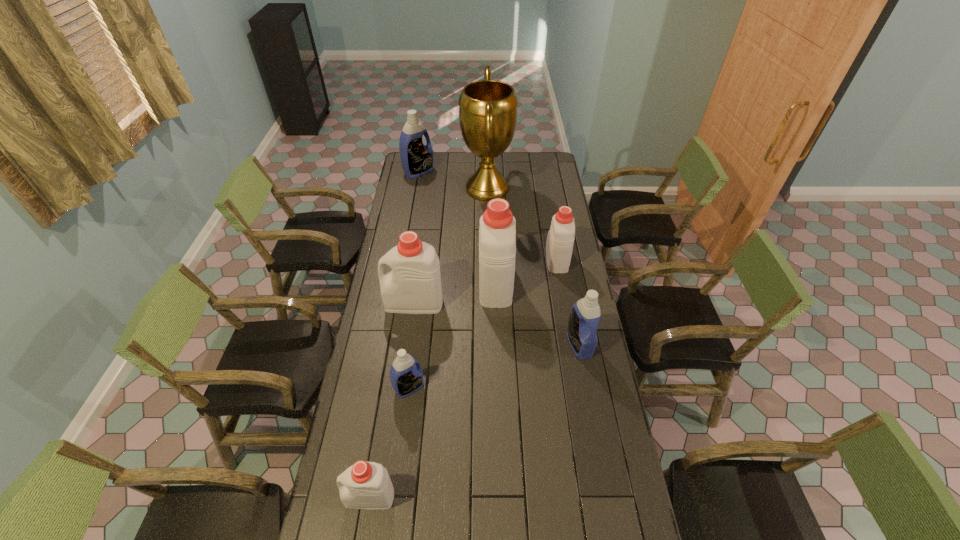
Locate which object ranks sixth in proximity to the second tallest object. Please provide its 2D coordinates. Your answer should be formatted as a tuple, i.e. [(x, y)], where the tuple contains the x and y coordinates of a point satisfying the conditions above.

[(417, 159)]

Select which object is the third closest to the third white detergent from left to right. Please provide its 2D coordinates. Your answer should be formatted as a tuple, i.e. [(x, y)], where the tuple contains the x and y coordinates of a point satisfying the conditions above.

[(585, 314)]

Where is `detergent identified as the third closest to the biggest white detergent`? The width and height of the screenshot is (960, 540). detergent identified as the third closest to the biggest white detergent is located at coordinates (585, 314).

I want to click on detergent that is the fourth closest one to the smallest blue detergent, so click(585, 314).

This screenshot has height=540, width=960. I want to click on the second closest white detergent to the gold trophy cup, so click(497, 233).

Identify which white detergent is the fourth nearest to the farthest detergent. Please provide its 2D coordinates. Your answer should be formatted as a tuple, i.e. [(x, y)], where the tuple contains the x and y coordinates of a point satisfying the conditions above.

[(365, 485)]

Where is `blue detergent that is the closest to the second tallest object`? Image resolution: width=960 pixels, height=540 pixels. blue detergent that is the closest to the second tallest object is located at coordinates point(585,314).

The height and width of the screenshot is (540, 960). Identify the location of blue detergent that can be found as the closest to the nearest blue detergent. (585, 314).

Locate an element on the screen. Image resolution: width=960 pixels, height=540 pixels. free space that satisfies the following two spatial constraints: 1. on the surface of the second nearest blue detergent with symbols; 2. on the left side of the trophy cup is located at coordinates (491, 345).

I want to click on free space that satisfies the following two spatial constraints: 1. on the surface of the tallest object with symbols; 2. on the back side of the second smallest blue detergent, so click(x=491, y=345).